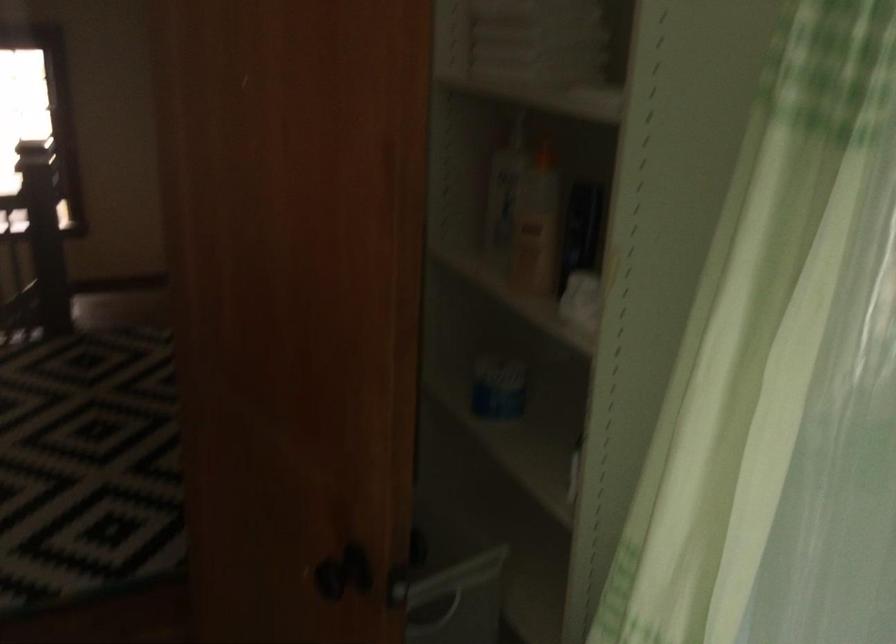
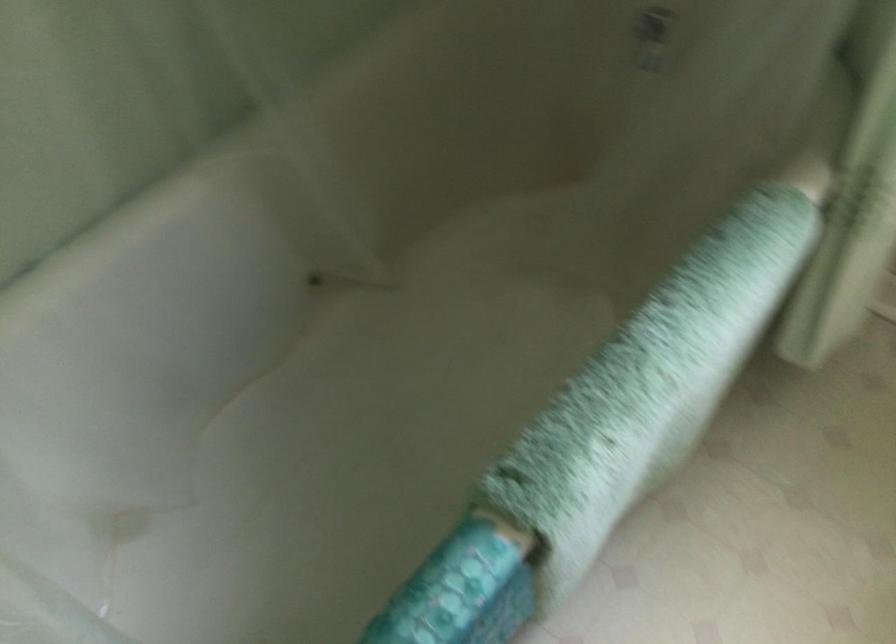
How did the camera likely rotate?

The camera's rotation is toward right-down.